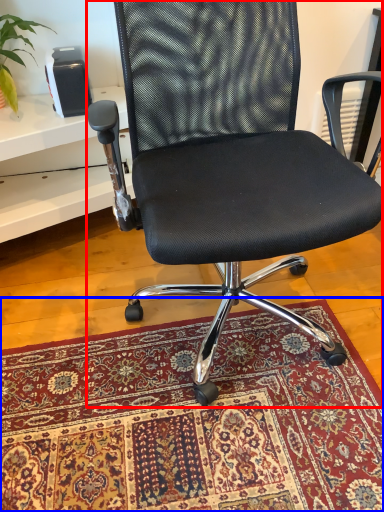
Question: Which object appears closest to the camera in this image, chair (highlighted by a red box) or mat (highlighted by a blue box)?

Choices:
 (A) chair
 (B) mat

Answer: (A)